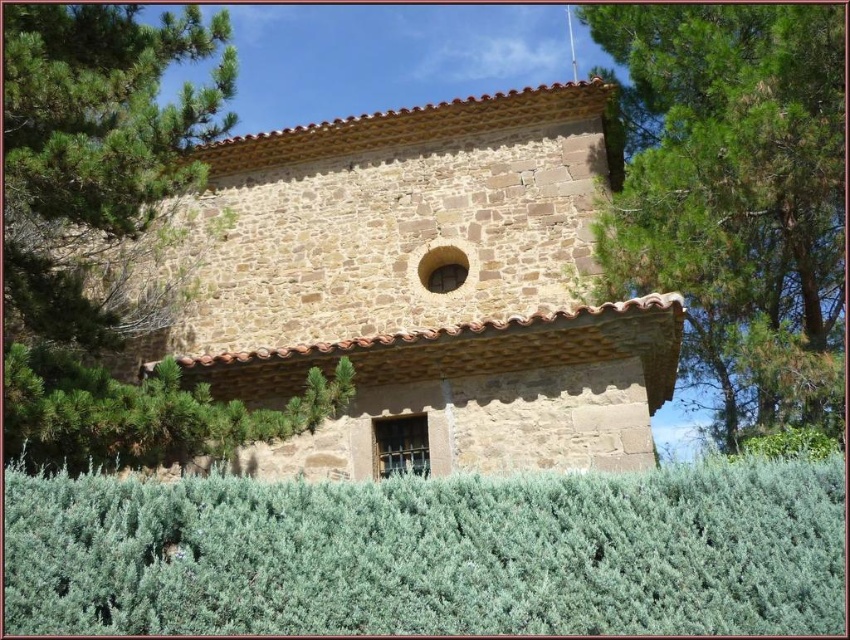
Is point (479, 536) less distant than point (66, 390)?

Yes, it is.

Is green shrubbery at center thinner than green leafy bush at lower left?

No, green shrubbery at center is not thinner than green leafy bush at lower left.

Is point (212, 516) farther from viewer compared to point (212, 422)?

No, (212, 516) is closer to viewer.

The width and height of the screenshot is (850, 640). Find the location of `green shrubbery at center`. green shrubbery at center is located at coordinates (432, 554).

Does green shrubbery at center have a lesser width compared to green leafy tree at upper left?

No.

Is point (184, 483) more distant than point (26, 134)?

No, (184, 483) is closer to viewer.

Image resolution: width=850 pixels, height=640 pixels. Identify the location of green shrubbery at center. (432, 554).

Can you confirm if green leafy tree at upper right is positioned below green leafy bush at lower left?

Incorrect, green leafy tree at upper right is not positioned below green leafy bush at lower left.

Can you confirm if green leafy tree at upper right is wider than green leafy bush at lower left?

Yes.

This screenshot has width=850, height=640. Identify the location of green leafy tree at upper right. (735, 195).